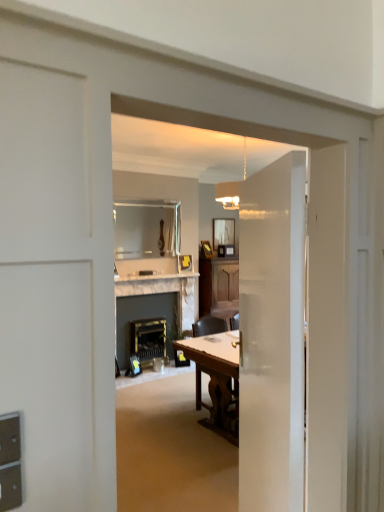
Question: From the image's perspective, is wooden chair at center under matte glass mirror at upper center, which is counted as the 1th mirror, starting from the right?

Choices:
 (A) no
 (B) yes

Answer: (B)

Question: Is wooden chair at center turned away from matte glass mirror at upper center, which is the 1th mirror from back to front?

Choices:
 (A) yes
 (B) no

Answer: (B)

Question: From the image's perspective, does wooden chair at center appear higher than matte glass mirror at upper center, the 2th mirror when ordered from front to back?

Choices:
 (A) no
 (B) yes

Answer: (A)

Question: Is wooden chair at center at the right side of matte glass mirror at upper center, acting as the 2th mirror starting from the left?

Choices:
 (A) no
 (B) yes

Answer: (A)

Question: Is wooden chair at center behind matte glass mirror at upper center, the 2th mirror when ordered from front to back?

Choices:
 (A) no
 (B) yes

Answer: (A)

Question: Is wooden chair at center completely or partially outside of matte glass mirror at upper center, acting as the 2th mirror starting from the left?

Choices:
 (A) no
 (B) yes

Answer: (B)

Question: Are clear glass mirror at upper center, which appears as the second mirror when viewed from the back, and white glossy door at center far apart?

Choices:
 (A) no
 (B) yes

Answer: (B)

Question: From a real-world perspective, is clear glass mirror at upper center, positioned as the second mirror in right-to-left order, located higher than white glossy door at center?

Choices:
 (A) yes
 (B) no

Answer: (A)

Question: From the image's perspective, is clear glass mirror at upper center, which appears as the second mirror when viewed from the back, under white glossy door at center?

Choices:
 (A) yes
 (B) no

Answer: (B)

Question: Is clear glass mirror at upper center, acting as the first mirror starting from the front, facing away from white glossy door at center?

Choices:
 (A) no
 (B) yes

Answer: (A)

Question: From the image's perspective, is clear glass mirror at upper center, acting as the first mirror starting from the front, on top of white glossy door at center?

Choices:
 (A) no
 (B) yes

Answer: (B)

Question: Considering the relative sizes of clear glass mirror at upper center, the first mirror from the left, and white glossy door at center in the image provided, is clear glass mirror at upper center, the first mirror from the left, bigger than white glossy door at center?

Choices:
 (A) yes
 (B) no

Answer: (B)

Question: Does matte glass mirror at upper center, which is counted as the 1th mirror, starting from the right, have a lesser height compared to white marble fireplace at center?

Choices:
 (A) yes
 (B) no

Answer: (B)